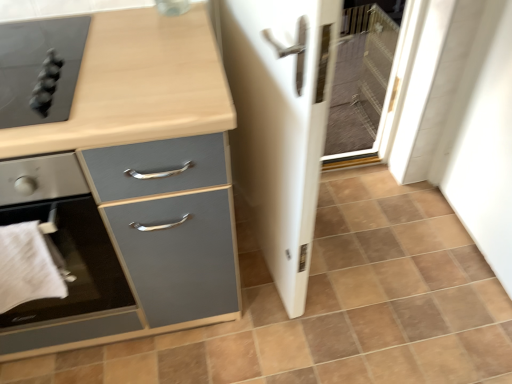
This screenshot has height=384, width=512. I want to click on matte black stove at left, the 1th home appliance in the bottom-to-top sequence, so click(x=64, y=257).

Identify the location of brown matte tile at center. (334, 306).

You are a GUI agent. You are given a task and a screenshot of the screen. Output one action in this format:
    pyautogui.click(x=<x>, y=<y>)
    Task: Click on the white glossy screen door at center
    Image resolution: width=512 pixels, height=384 pixels.
    Given the screenshot: What is the action you would take?
    pyautogui.click(x=281, y=123)

Describe the element at coordinates (132, 187) in the screenshot. I see `matte gray cabinet at left` at that location.

Identify the location of matte black stove at left, which appears as the 2th home appliance when viewed from the top. The width and height of the screenshot is (512, 384). (64, 257).

Between matte black stove at left, the 1th home appliance in the bottom-to-top sequence, and matte gray cabinet at left, which one has smaller size?

matte black stove at left, the 1th home appliance in the bottom-to-top sequence.

Consider the image. Can you see matte black stove at left, the 1th home appliance in the bottom-to-top sequence, touching matte gray cabinet at left?

No, matte black stove at left, the 1th home appliance in the bottom-to-top sequence, is not with matte gray cabinet at left.

How many degrees apart are the facing directions of matte black stove at left, which appears as the 2th home appliance when viewed from the top, and matte gray cabinet at left?

3.5e-05 degrees separate the facing orientations of matte black stove at left, which appears as the 2th home appliance when viewed from the top, and matte gray cabinet at left.

Does point (87, 238) lie behind point (7, 173)?

Yes.

Between brown matte tile at center and matte gray cabinet at left, which one appears on the left side from the viewer's perspective?

From the viewer's perspective, matte gray cabinet at left appears more on the left side.

Which object is further away from the camera taking this photo, brown matte tile at center or matte gray cabinet at left?

Positioned behind is brown matte tile at center.

Is point (426, 204) farther from viewer compared to point (217, 91)?

Yes, point (426, 204) is farther from viewer.

Does brown matte tile at center have a lesser width compared to matte gray cabinet at left?

In fact, brown matte tile at center might be wider than matte gray cabinet at left.

From the picture: Is matte gray cabinet at left oriented towards matte black cooktop at upper left, the second home appliance ordered from the bottom?

No.

Is point (120, 71) closer to viewer compared to point (24, 119)?

That is False.

Do you think matte gray cabinet at left is within matte black cooktop at upper left, acting as the 1th home appliance starting from the top, or outside of it?

matte gray cabinet at left lies outside matte black cooktop at upper left, acting as the 1th home appliance starting from the top.

From a real-world perspective, is matte gray cabinet at left on matte black cooktop at upper left, acting as the 1th home appliance starting from the top?

No, from a real-world perspective, matte gray cabinet at left is not over matte black cooktop at upper left, acting as the 1th home appliance starting from the top

Is matte black stove at left, which appears as the 2th home appliance when viewed from the top, thinner than matte black cooktop at upper left, acting as the 1th home appliance starting from the top?

In fact, matte black stove at left, which appears as the 2th home appliance when viewed from the top, might be wider than matte black cooktop at upper left, acting as the 1th home appliance starting from the top.

Can you confirm if matte black stove at left, which appears as the 2th home appliance when viewed from the top, is positioned to the left of matte black cooktop at upper left, the second home appliance ordered from the bottom?

Correct, you'll find matte black stove at left, which appears as the 2th home appliance when viewed from the top, to the left of matte black cooktop at upper left, the second home appliance ordered from the bottom.

From a real-world perspective, does matte black stove at left, which appears as the 2th home appliance when viewed from the top, sit lower than matte black cooktop at upper left, the second home appliance ordered from the bottom?

Correct, in the physical world, matte black stove at left, which appears as the 2th home appliance when viewed from the top, is lower than matte black cooktop at upper left, the second home appliance ordered from the bottom.

Between matte black stove at left, which appears as the 2th home appliance when viewed from the top, and matte black cooktop at upper left, acting as the 1th home appliance starting from the top, which one is positioned behind?

matte black cooktop at upper left, acting as the 1th home appliance starting from the top.

Would you consider matte black cooktop at upper left, the second home appliance ordered from the bottom, to be distant from white cloth at lower left?

No, matte black cooktop at upper left, the second home appliance ordered from the bottom, is not far from white cloth at lower left.

Can you confirm if matte black cooktop at upper left, the second home appliance ordered from the bottom, is positioned to the left of white cloth at lower left?

No.

Find the location of a particular element. This screenshot has height=384, width=512. hand towel beneath the matte black cooktop at upper left, acting as the 1th home appliance starting from the top (from a real-world perspective) is located at coordinates (29, 266).

Does matte black cooktop at upper left, the second home appliance ordered from the bottom, have a greater width compared to white cloth at lower left?

Yes.

Can you confirm if matte gray cabinet at left is bigger than white cloth at lower left?

Yes.

Is white cloth at lower left at the back of matte gray cabinet at left?

Yes, matte gray cabinet at left is facing away from white cloth at lower left.

Considering the sizes of objects matte gray cabinet at left and white cloth at lower left in the image provided, who is taller, matte gray cabinet at left or white cloth at lower left?

matte gray cabinet at left.

Is matte gray cabinet at left positioned beyond the bounds of white cloth at lower left?

Yes, matte gray cabinet at left is not within white cloth at lower left.

From a real-world perspective, is white cloth at lower left physically below matte gray cabinet at left?

No, from a real-world perspective, white cloth at lower left is not below matte gray cabinet at left.

Between white cloth at lower left and matte gray cabinet at left, which one is positioned in front?

Positioned in front is matte gray cabinet at left.

In terms of width, does white cloth at lower left look wider or thinner when compared to matte gray cabinet at left?

In the image, white cloth at lower left appears to be more narrow than matte gray cabinet at left.

This screenshot has height=384, width=512. In order to click on the 2nd home appliance counting from the left side of the matte gray cabinet at left in this screenshot , I will do `click(64, 257)`.

The height and width of the screenshot is (384, 512). I want to click on the chest of drawers that appears above the brown matte tile at center (from the image's perspective), so click(x=132, y=187).

Considering their positions, is matte black cooktop at upper left, acting as the 1th home appliance starting from the top, positioned further to white glossy screen door at center than brown matte tile at center?

matte black cooktop at upper left, acting as the 1th home appliance starting from the top, is further to white glossy screen door at center.

Considering their positions, is matte black cooktop at upper left, acting as the 1th home appliance starting from the top, positioned closer to brown matte tile at center than matte black stove at left, which appears as the 2th home appliance when viewed from the top?

The object closer to brown matte tile at center is matte black stove at left, which appears as the 2th home appliance when viewed from the top.

From the image, which object appears to be farther from white cloth at lower left, white glossy screen door at center or brown matte tile at center?

Among the two, brown matte tile at center is located further to white cloth at lower left.

In the scene shown: Which object lies further to the anchor point white cloth at lower left, matte black cooktop at upper left, acting as the 1th home appliance starting from the top, or matte black stove at left, which appears as the 2th home appliance when viewed from the top?

Based on the image, matte black cooktop at upper left, acting as the 1th home appliance starting from the top, appears to be further to white cloth at lower left.

When comparing their distances from matte gray cabinet at left, does white cloth at lower left or white glossy screen door at center seem closer?

The object closer to matte gray cabinet at left is white cloth at lower left.

Which object lies further to the anchor point white cloth at lower left, matte black stove at left, the 1th home appliance in the bottom-to-top sequence, or brown matte tile at center?

brown matte tile at center lies further to white cloth at lower left than the other object.

From the image, which object appears to be farther from brown matte tile at center, matte gray cabinet at left or matte black stove at left, the 1th home appliance in the bottom-to-top sequence?

matte black stove at left, the 1th home appliance in the bottom-to-top sequence, is positioned further to the anchor brown matte tile at center.

Which object lies nearer to the anchor point brown matte tile at center, matte black cooktop at upper left, acting as the 1th home appliance starting from the top, or white glossy screen door at center?

Based on the image, white glossy screen door at center appears to be nearer to brown matte tile at center.

Where is `home appliance between white cloth at lower left and brown matte tile at center from left to right`? home appliance between white cloth at lower left and brown matte tile at center from left to right is located at coordinates (40, 69).

I want to click on chest of drawers between matte black cooktop at upper left, acting as the 1th home appliance starting from the top, and white glossy screen door at center, so click(x=132, y=187).

At what (x,y) coordinates should I click in order to perform the action: click on chest of drawers between matte black stove at left, which appears as the 2th home appliance when viewed from the top, and white glossy screen door at center. Please return your answer as a coordinate pair (x, y). The height and width of the screenshot is (384, 512). Looking at the image, I should click on (132, 187).

Locate an element on the screen. The height and width of the screenshot is (384, 512). home appliance between matte black stove at left, the 1th home appliance in the bottom-to-top sequence, and white glossy screen door at center is located at coordinates (40, 69).